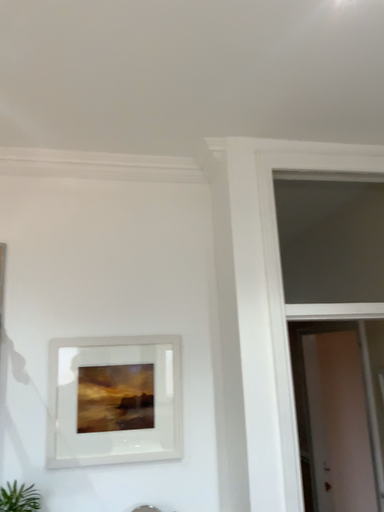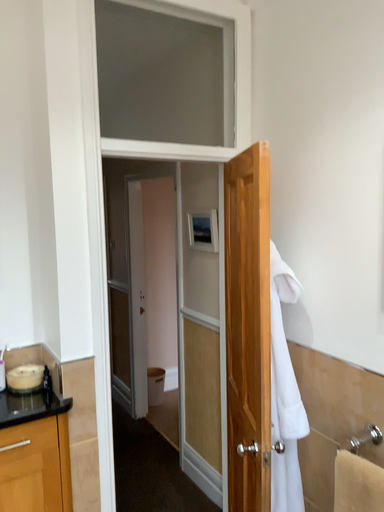
Question: How did the camera likely rotate when shooting the video?

Choices:
 (A) rotated upward
 (B) rotated downward

Answer: (B)